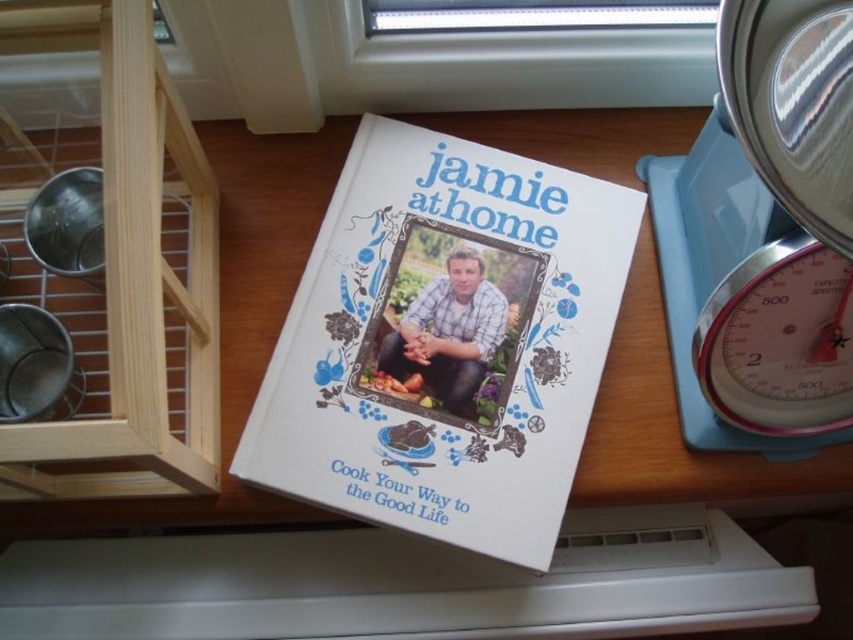
The width and height of the screenshot is (853, 640). Find the location of `blue plastic scale at right`. blue plastic scale at right is located at coordinates (763, 234).

Is blue plastic scale at right closer to the viewer compared to white plastic scale at right?

Yes, blue plastic scale at right is in front of white plastic scale at right.

The image size is (853, 640). I want to click on blue plastic scale at right, so click(763, 234).

Identify the location of blue plastic scale at right. (763, 234).

Where is `blue plastic scale at right`? The height and width of the screenshot is (640, 853). blue plastic scale at right is located at coordinates coord(763,234).

Does white plastic scale at right have a lesser height compared to matte white book at center?

Incorrect, white plastic scale at right's height does not fall short of matte white book at center's.

Is white plastic scale at right taller than matte white book at center?

Indeed, white plastic scale at right has a greater height compared to matte white book at center.

You are a GUI agent. You are given a task and a screenshot of the screen. Output one action in this format:
    pyautogui.click(x=<x>, y=<y>)
    Task: Click on the white plastic scale at right
    
    Given the screenshot: What is the action you would take?
    pyautogui.click(x=779, y=340)

Find the location of a particular element. The width and height of the screenshot is (853, 640). white plastic scale at right is located at coordinates (779, 340).